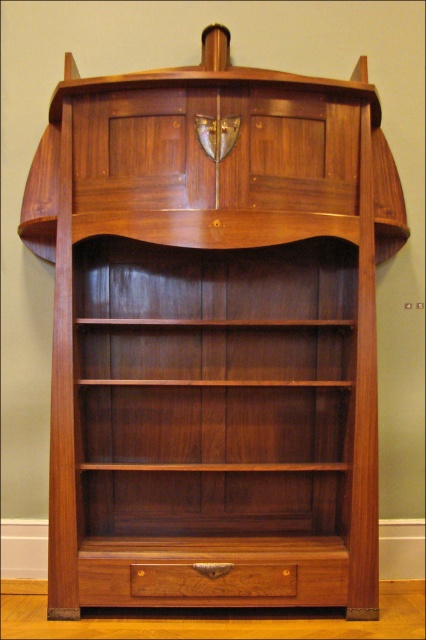
Question: Is brown wood drawer at lower center thinner than polished wood drawer at lower center?

Choices:
 (A) yes
 (B) no

Answer: (B)

Question: Which point is farther to the camera?

Choices:
 (A) polished wood drawer at lower center
 (B) brown wood drawer at lower center

Answer: (B)

Question: Does brown wood drawer at lower center appear under polished wood drawer at lower center?

Choices:
 (A) yes
 (B) no

Answer: (B)

Question: Which point is farther from the camera taking this photo?

Choices:
 (A) (282, 582)
 (B) (313, 568)

Answer: (B)

Question: Can you confirm if brown wood drawer at lower center is positioned above polished wood drawer at lower center?

Choices:
 (A) yes
 (B) no

Answer: (A)